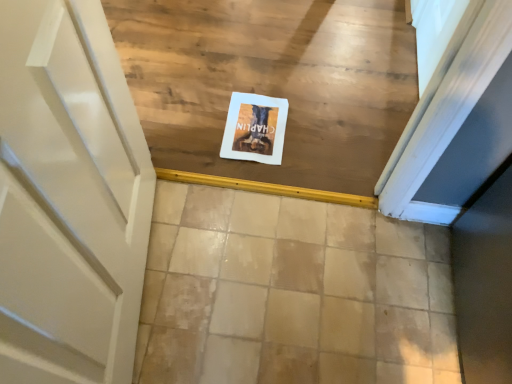
This screenshot has width=512, height=384. What do you see at coordinates (255, 128) in the screenshot?
I see `white paper at center` at bounding box center [255, 128].

Image resolution: width=512 pixels, height=384 pixels. In order to click on white paper at center in this screenshot , I will do `click(255, 128)`.

I want to click on beige tile at center, so click(x=291, y=293).

This screenshot has height=384, width=512. Describe the element at coordinates (291, 293) in the screenshot. I see `beige tile at center` at that location.

In order to face beige tile at center, should I rotate leftwards or rightwards?

You should look right and rotate roughly 7.512 degrees.

You are a GUI agent. You are given a task and a screenshot of the screen. Output one action in this format:
    pyautogui.click(x=<x>, y=<y>)
    Task: Click on the white paper at center
    Image resolution: width=512 pixels, height=384 pixels.
    Given the screenshot: What is the action you would take?
    pyautogui.click(x=255, y=128)

Between beige tile at center and white paper at center, which one appears on the left side from the viewer's perspective?

white paper at center.

Based on the photo, considering the relative positions of beige tile at center and white paper at center in the image provided, is beige tile at center behind white paper at center?

No, beige tile at center is closer to the viewer.

Between point (451, 354) and point (249, 145), which one is positioned in front?

Positioned in front is point (451, 354).

From the image's perspective, does beige tile at center appear higher than white paper at center?

No, from the image's perspective, beige tile at center is not above white paper at center.

From a real-world perspective, is beige tile at center positioned above or below white paper at center?

Clearly, from a real-world perspective, beige tile at center is below white paper at center.

Which object is wider, beige tile at center or white paper at center?

beige tile at center.

Which of these two, beige tile at center or white paper at center, stands shorter?

Standing shorter between the two is white paper at center.

Which of these two, beige tile at center or white paper at center, is smaller?

white paper at center.

Would you say beige tile at center is inside or outside white paper at center?

The correct answer is: outside.

Is beige tile at center positioned far away from white paper at center?

No.

Is white paper at center at the back of beige tile at center?

That's right, beige tile at center is facing away from white paper at center.

How different are the orientations of beige tile at center and white paper at center in degrees?

beige tile at center and white paper at center are facing 175 degrees away from each other.

This screenshot has width=512, height=384. Identify the location of postcard that is above the beige tile at center (from a real-world perspective). (255, 128).

Is white paper at center at the right side of beige tile at center?

No, white paper at center is not to the right of beige tile at center.

Which object is further away from the camera, white paper at center or beige tile at center?

white paper at center is further away from the camera.

Which point is more distant from viewer, (x=239, y=128) or (x=352, y=373)?

The point (x=239, y=128) is more distant.

From the image's perspective, is white paper at center under beige tile at center?

No, from the image's perspective, white paper at center is not beneath beige tile at center.

From a real-world perspective, relative to beige tile at center, is white paper at center vertically above or below?

Clearly, from a real-world perspective, white paper at center is above beige tile at center.

Considering the sizes of objects white paper at center and beige tile at center in the image provided, who is wider, white paper at center or beige tile at center?

beige tile at center.

Considering the sizes of objects white paper at center and beige tile at center in the image provided, who is taller, white paper at center or beige tile at center?

With more height is beige tile at center.

Is white paper at center smaller than beige tile at center?

Yes.

Do you think white paper at center is within beige tile at center, or outside of it?

white paper at center is spatially situated outside beige tile at center.

Is there a large distance between white paper at center and beige tile at center?

No, white paper at center is not far from beige tile at center.

Is beige tile at center at the back of white paper at center?

Yes, white paper at center is positioned with its back facing beige tile at center.

What's the angular difference between white paper at center and beige tile at center's facing directions?

175 degrees.

Measure the distance between white paper at center and beige tile at center.

white paper at center is 43.63 centimeters away from beige tile at center.

I want to click on postcard behind the beige tile at center, so click(255, 128).

In order to click on tile beneath the white paper at center (from a real-world perspective) in this screenshot , I will do tap(291, 293).

Find the location of a particular element. This screenshot has width=512, height=384. tile in front of the white paper at center is located at coordinates (291, 293).